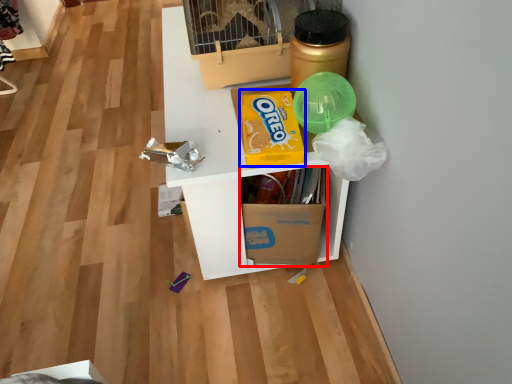
Question: Which object appears farthest to the camera in this image, cardboard box (highlighted by a red box) or cereal (highlighted by a blue box)?

Choices:
 (A) cardboard box
 (B) cereal

Answer: (A)